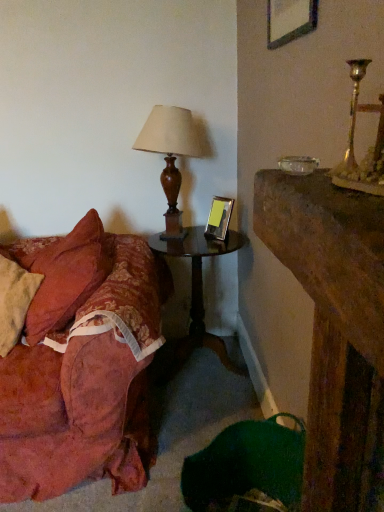
Question: Should I look upward or downward to see wooden lampshade at left?

Choices:
 (A) down
 (B) up

Answer: (B)

Question: Is floral fabric couch at left located within metallic silver picture frame at center, which is the first picture frame from left to right?

Choices:
 (A) yes
 (B) no

Answer: (B)

Question: From a real-world perspective, does metallic silver picture frame at center, the 2th picture frame from the front, stand above floral fabric couch at left?

Choices:
 (A) no
 (B) yes

Answer: (B)

Question: Is metallic silver picture frame at center, which is the first picture frame from left to right, positioned beyond the bounds of floral fabric couch at left?

Choices:
 (A) yes
 (B) no

Answer: (A)

Question: Does metallic silver picture frame at center, the 2th picture frame from the front, appear on the right side of floral fabric couch at left?

Choices:
 (A) yes
 (B) no

Answer: (A)

Question: Considering the relative sizes of metallic silver picture frame at center, which is the 2th picture frame from top to bottom, and floral fabric couch at left in the image provided, is metallic silver picture frame at center, which is the 2th picture frame from top to bottom, thinner than floral fabric couch at left?

Choices:
 (A) no
 (B) yes

Answer: (B)

Question: Considering the relative sizes of metallic silver picture frame at center, acting as the 2th picture frame starting from the right, and floral fabric couch at left in the image provided, is metallic silver picture frame at center, acting as the 2th picture frame starting from the right, shorter than floral fabric couch at left?

Choices:
 (A) yes
 (B) no

Answer: (A)

Question: Would you say floral fabric couch at left is outside wooden lampshade at left?

Choices:
 (A) no
 (B) yes

Answer: (B)

Question: Can you see floral fabric couch at left touching wooden lampshade at left?

Choices:
 (A) no
 (B) yes

Answer: (A)

Question: Does floral fabric couch at left have a larger size compared to wooden lampshade at left?

Choices:
 (A) yes
 (B) no

Answer: (A)

Question: Is floral fabric couch at left not near wooden lampshade at left?

Choices:
 (A) yes
 (B) no

Answer: (B)

Question: Considering the relative sizes of floral fabric couch at left and wooden lampshade at left in the image provided, is floral fabric couch at left smaller than wooden lampshade at left?

Choices:
 (A) yes
 (B) no

Answer: (B)

Question: From the image's perspective, does floral fabric couch at left appear higher than wooden lampshade at left?

Choices:
 (A) no
 (B) yes

Answer: (A)

Question: Can you confirm if metallic silver picture frame at center, which is the 2th picture frame from top to bottom, is bigger than wooden dark brown side table at center?

Choices:
 (A) yes
 (B) no

Answer: (B)